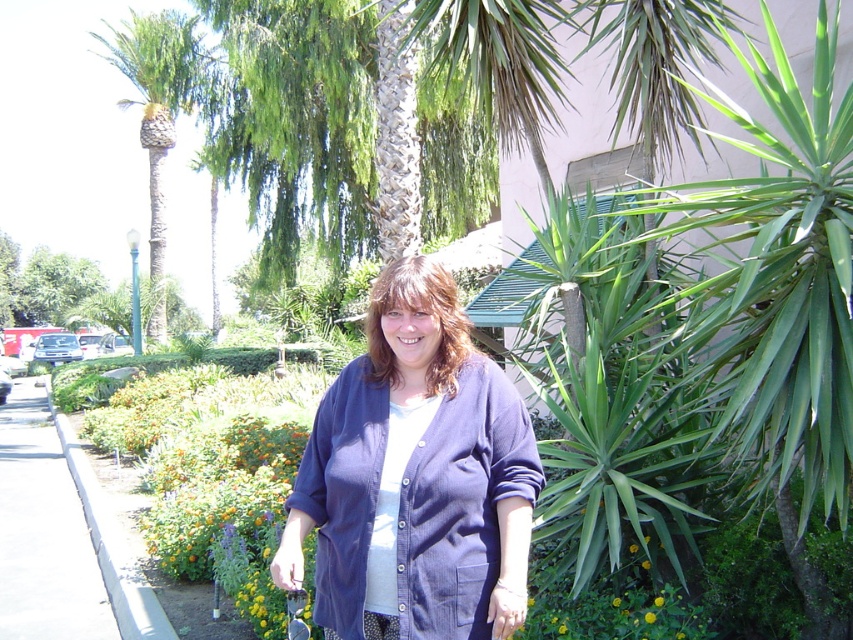
Question: Which of the following is the farthest from the observer?

Choices:
 (A) (148, 168)
 (B) (16, 577)

Answer: (A)

Question: Which point is closer to the camera taking this photo?

Choices:
 (A) (51, 580)
 (B) (193, 29)
 (C) (498, 620)

Answer: (C)

Question: Which of the following is the farthest from the observer?

Choices:
 (A) (456, 465)
 (B) (84, 612)

Answer: (B)

Question: Where is gray concrete sidewalk at lower left located in relation to green leafy palm tree at left in the image?

Choices:
 (A) left
 (B) right

Answer: (B)

Question: Does blue corduroy cardigan at center have a lesser width compared to gray concrete sidewalk at lower left?

Choices:
 (A) yes
 (B) no

Answer: (A)

Question: Does gray concrete sidewalk at lower left appear over green leafy palm tree at left?

Choices:
 (A) yes
 (B) no

Answer: (B)